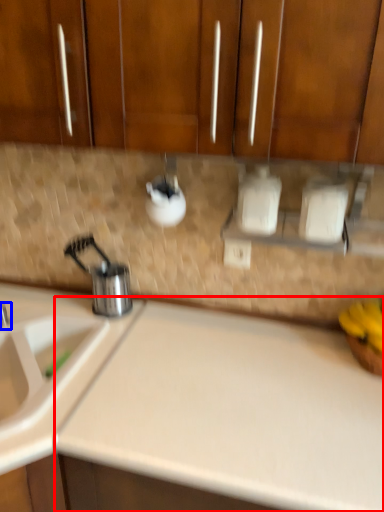
Question: Which object is closer to the camera taking this photo, counter top (highlighted by a red box) or tap (highlighted by a blue box)?

Choices:
 (A) counter top
 (B) tap

Answer: (A)